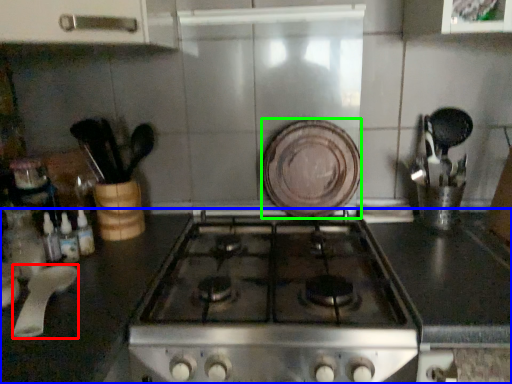
Question: Which object is positioned farthest from kitchen appliance (highlighted by a red box)? Select from countertop (highlighted by a blue box) and plate (highlighted by a green box).

Choices:
 (A) countertop
 (B) plate

Answer: (B)